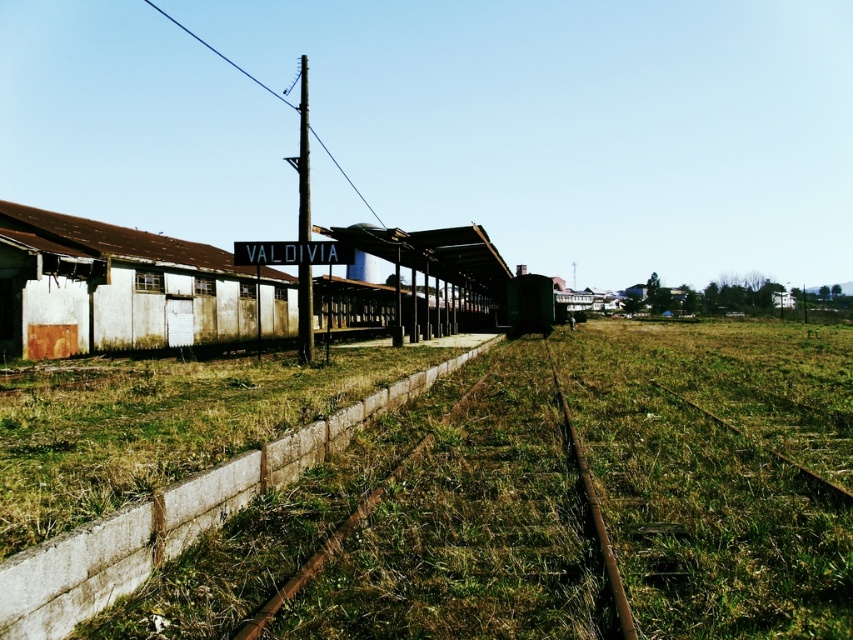
Question: Which point is farther to the camera?

Choices:
 (A) metallic pole at center
 (B) rusty metal train track at center

Answer: (A)

Question: Can you confirm if metallic pole at center is wider than rusty metal train track at center?

Choices:
 (A) no
 (B) yes

Answer: (B)

Question: Does metallic pole at center appear over rusty metal train track at center?

Choices:
 (A) no
 (B) yes

Answer: (B)

Question: Does metallic pole at center appear on the right side of rusty metal train track at center?

Choices:
 (A) no
 (B) yes

Answer: (A)

Question: Which point is closer to the camera?

Choices:
 (A) (590, 504)
 (B) (309, 218)

Answer: (A)

Question: Which object appears closest to the camera in this image?

Choices:
 (A) rusty metal train track at center
 (B) metallic pole at center

Answer: (A)